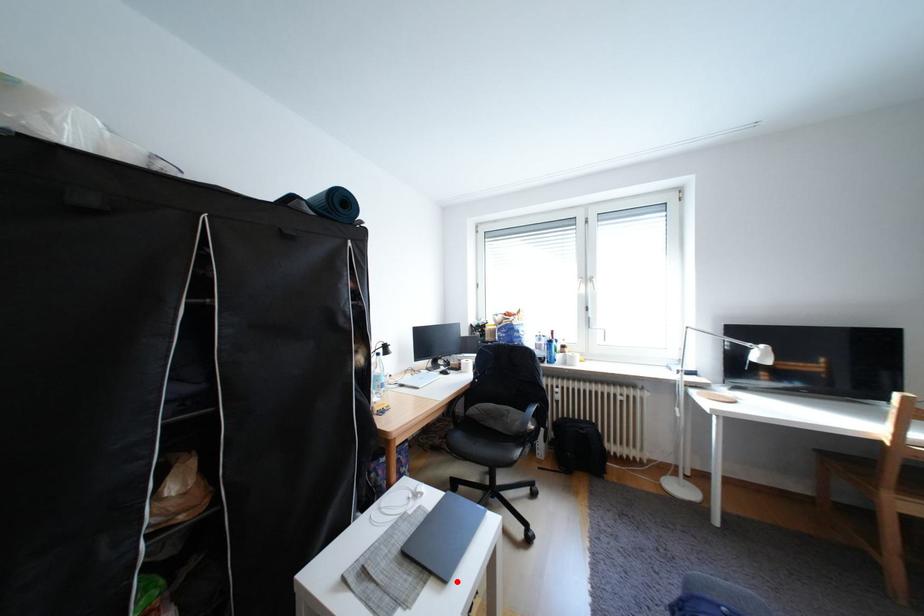
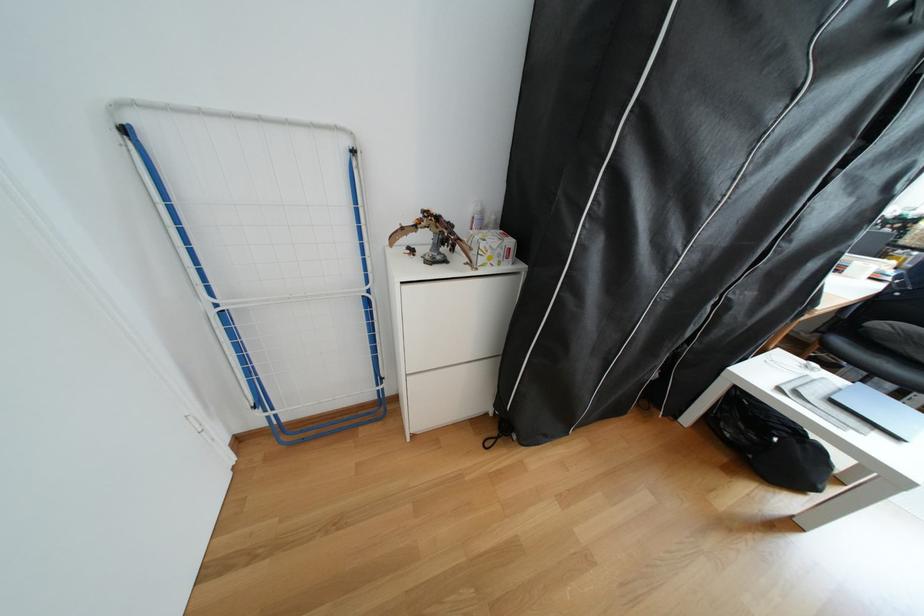
Find the pixel in the second image that matches the highlighted location in the first image.

(908, 439)